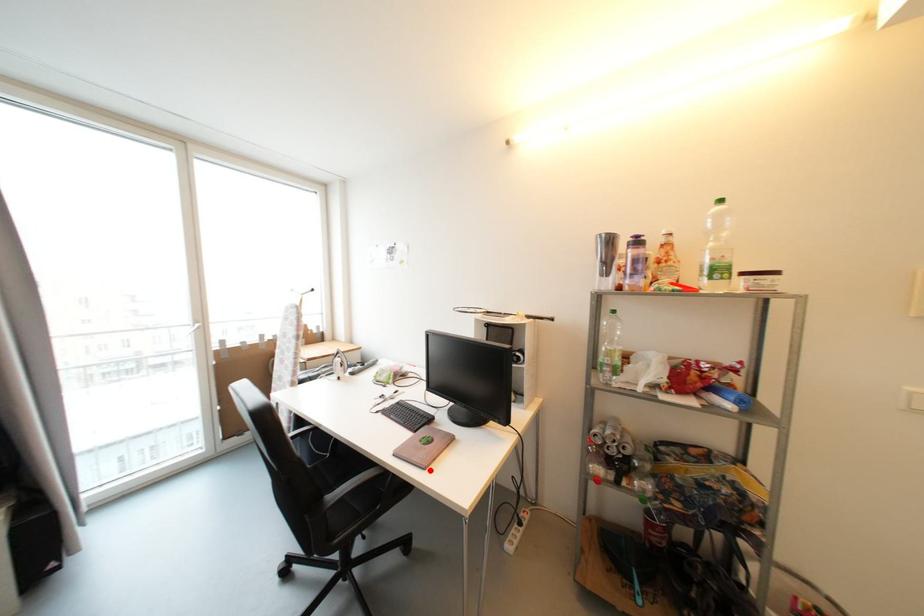
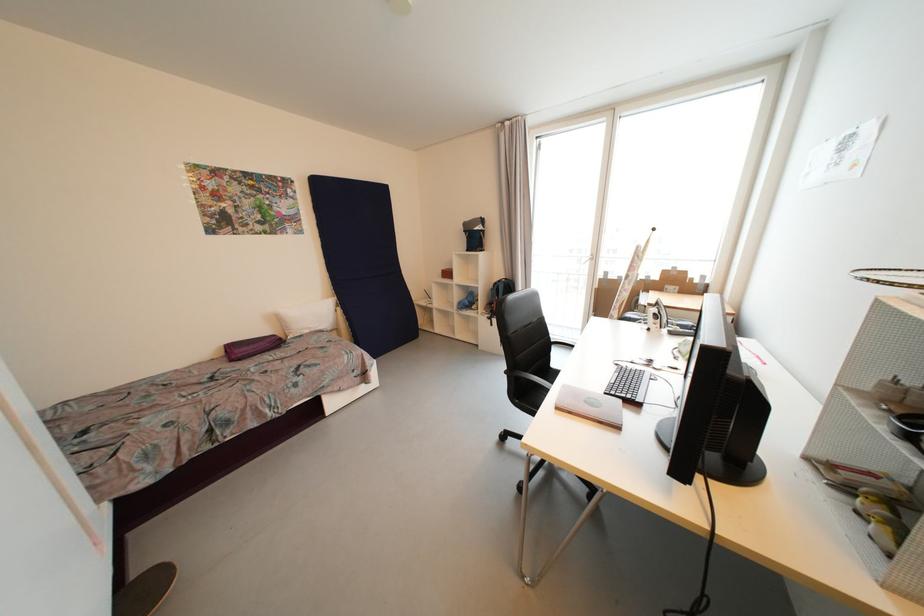
Locate, in the second image, the point that corresponds to the highlighted location in the first image.

(562, 410)